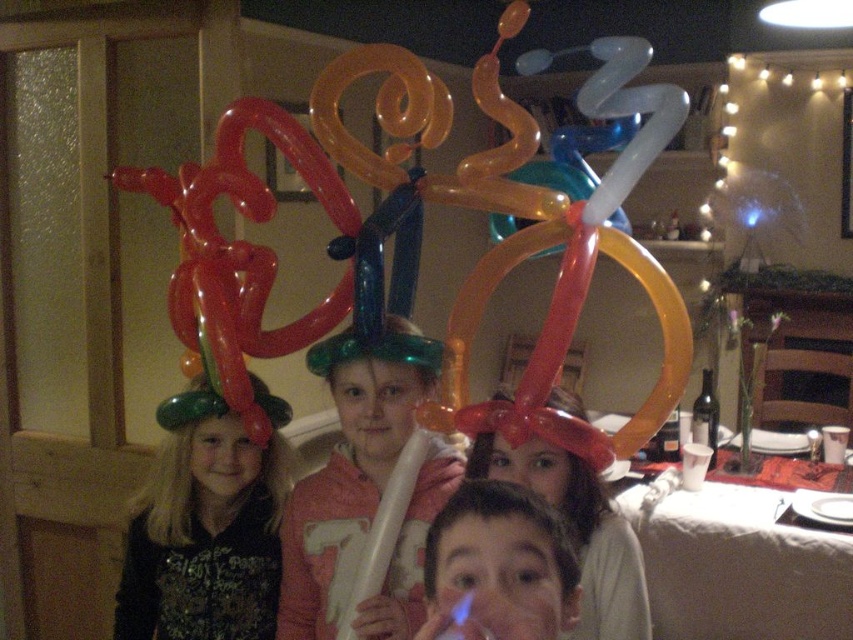
Who is positioned more to the right, green matte balloon hat at upper left or translucent plastic balloon at center?

Positioned to the right is translucent plastic balloon at center.

From the picture: Which is more to the left, green matte balloon hat at upper left or translucent plastic balloon at center?

green matte balloon hat at upper left is more to the left.

Is point (200, 381) positioned after point (299, 566)?

Yes, it is behind point (299, 566).

Identify the location of green matte balloon hat at upper left. The width and height of the screenshot is (853, 640). (206, 524).

Locate an element on the screen. The width and height of the screenshot is (853, 640). green matte balloon hat at upper left is located at coordinates (206, 524).

Does point (201, 605) come behind point (558, 458)?

Yes, it is.

Locate an element on the screen. The width and height of the screenshot is (853, 640). green matte balloon hat at upper left is located at coordinates coord(206,524).

Is translucent plastic balloon at center taller than matte balloon hat at center?

Yes, translucent plastic balloon at center is taller than matte balloon hat at center.

I want to click on translucent plastic balloon at center, so pyautogui.click(x=345, y=488).